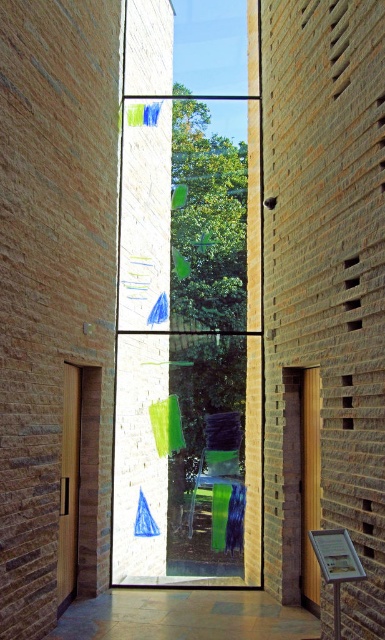
Question: Is transparent glass window at center wider than green fabric chair at center?

Choices:
 (A) yes
 (B) no

Answer: (B)

Question: Is wooden door at left positioned at the back of green fabric chair at center?

Choices:
 (A) yes
 (B) no

Answer: (B)

Question: Which point appears farthest from the camera in this image?

Choices:
 (A) (229, 493)
 (B) (127, 228)

Answer: (B)

Question: Which object is closer to the camera taking this photo?

Choices:
 (A) wooden door at left
 (B) transparent glass window at center
 (C) green fabric chair at center

Answer: (A)

Question: Which object is closer to the camera taking this photo?

Choices:
 (A) transparent glass window at center
 (B) green fabric chair at center
 (C) wooden door at left

Answer: (C)

Question: Does transparent glass window at center come in front of wooden door at left?

Choices:
 (A) yes
 (B) no

Answer: (B)